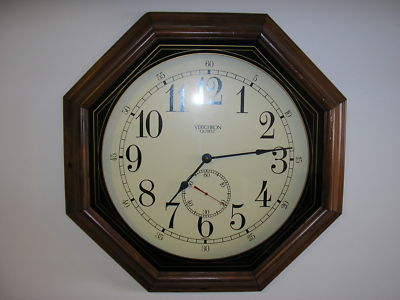
Image resolution: width=400 pixels, height=300 pixels. Find the location of `wood frame`. wood frame is located at coordinates (189, 280).